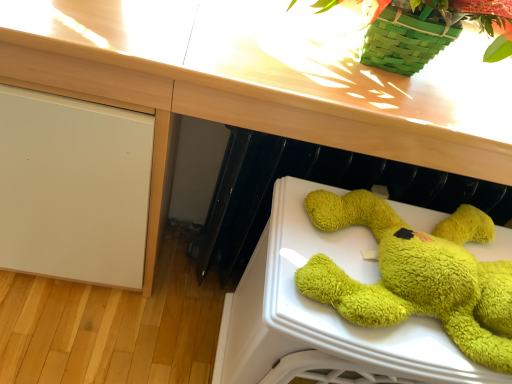
Question: From a real-world perspective, is green fuzzy stuffed animal at lower right positioned above or below wooden at upper center?

Choices:
 (A) above
 (B) below

Answer: (B)

Question: From the image's perspective, is green fuzzy stuffed animal at lower right positioned above or below wooden at upper center?

Choices:
 (A) below
 (B) above

Answer: (A)

Question: Looking at their shapes, would you say green fuzzy stuffed animal at lower right is wider or thinner than wooden at upper center?

Choices:
 (A) thin
 (B) wide

Answer: (A)

Question: Considering the positions of point (326, 92) and point (402, 279), is point (326, 92) closer or farther from the camera than point (402, 279)?

Choices:
 (A) farther
 (B) closer

Answer: (A)

Question: Do you think wooden at upper center is within green fuzzy stuffed animal at lower right, or outside of it?

Choices:
 (A) inside
 (B) outside

Answer: (B)

Question: Considering the positions of wooden at upper center and green fuzzy stuffed animal at lower right in the image, is wooden at upper center bigger or smaller than green fuzzy stuffed animal at lower right?

Choices:
 (A) small
 (B) big

Answer: (B)

Question: Based on their positions, is wooden at upper center located to the left or right of green fuzzy stuffed animal at lower right?

Choices:
 (A) left
 (B) right

Answer: (A)